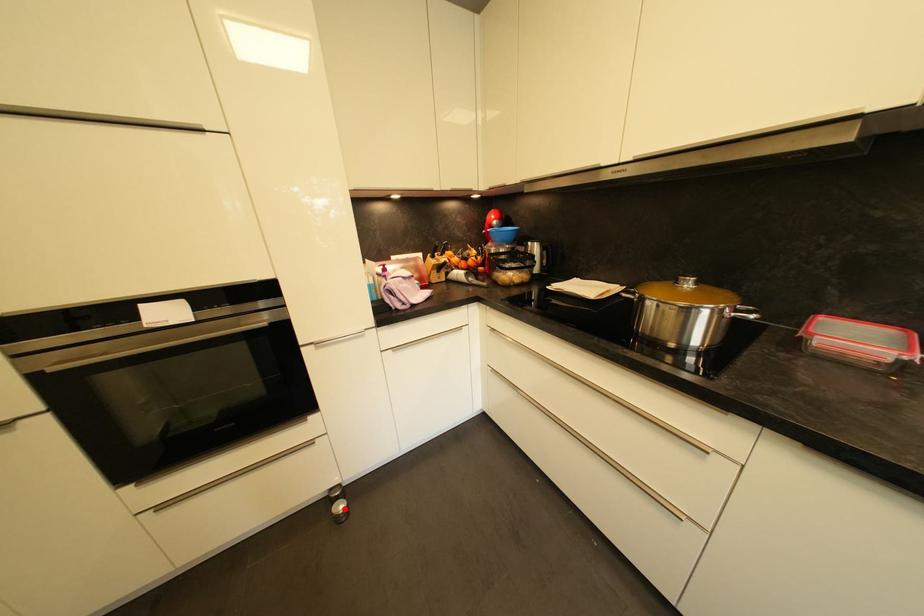
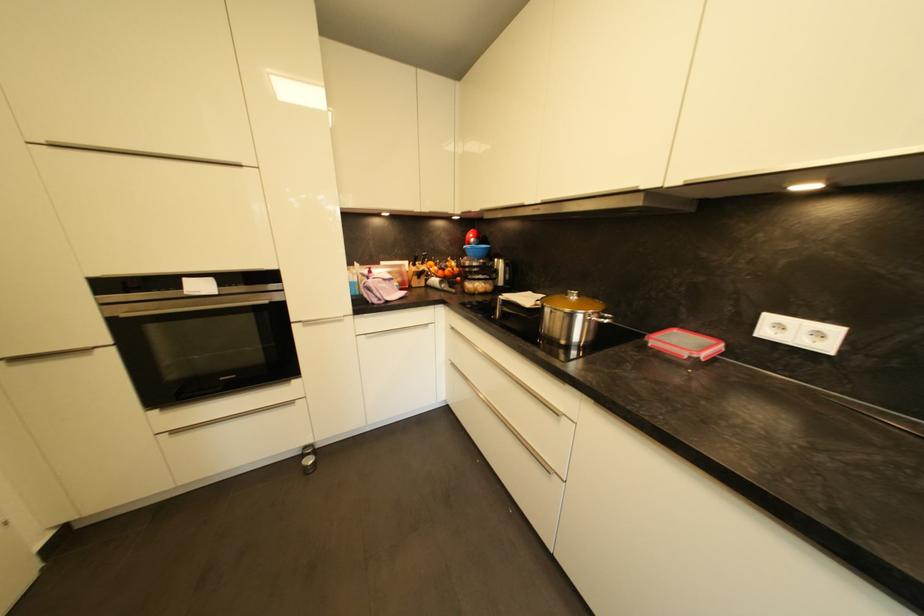
Locate, in the second image, the point that corresponds to the highlighted location in the first image.

(313, 463)